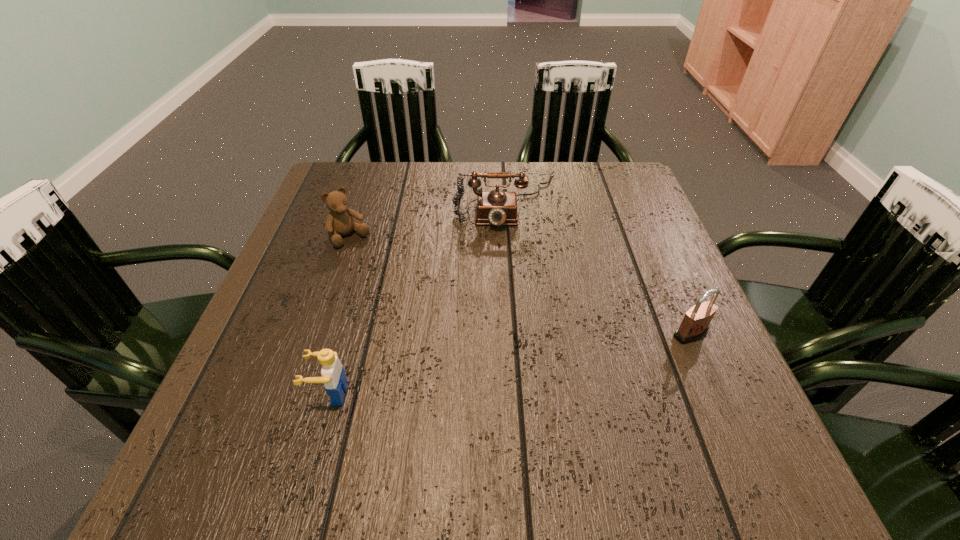
Identify the location of free area in between the third object from left to right and the rightmost object. (599, 267).

In order to click on free space between the padlock and the telephone in this screenshot , I will do `click(599, 267)`.

Identify the location of free spot between the teddy bear and the second nearest object. (520, 286).

Locate which object is the closest to the telephone. Please provide its 2D coordinates. Your answer should be formatted as a tuple, i.e. [(x, y)], where the tuple contains the x and y coordinates of a point satisfying the conditions above.

[(339, 222)]

Locate which object ranks second in proximity to the second object from right to left. Please provide its 2D coordinates. Your answer should be formatted as a tuple, i.e. [(x, y)], where the tuple contains the x and y coordinates of a point satisfying the conditions above.

[(695, 324)]

Find the location of a particular element. vacant region that satisfies the following two spatial constraints: 1. on the front side of the teddy bear; 2. on the face of the nearest object is located at coordinates (297, 394).

Find the location of `vacant region that satisfies the following two spatial constraints: 1. on the front side of the Lego; 2. on the face of the teddy bear`. vacant region that satisfies the following two spatial constraints: 1. on the front side of the Lego; 2. on the face of the teddy bear is located at coordinates (297, 394).

What are the coordinates of `free point that satisfies the following two spatial constraints: 1. on the front side of the third farthest object; 2. on the right side of the teddy bear` in the screenshot? It's located at (318, 333).

This screenshot has width=960, height=540. I want to click on free space that satisfies the following two spatial constraints: 1. on the front side of the teddy bear; 2. on the face of the Lego, so click(297, 394).

Where is `free location that satisfies the following two spatial constraints: 1. on the front side of the Lego; 2. on the face of the teddy bear`? Image resolution: width=960 pixels, height=540 pixels. free location that satisfies the following two spatial constraints: 1. on the front side of the Lego; 2. on the face of the teddy bear is located at coordinates (297, 394).